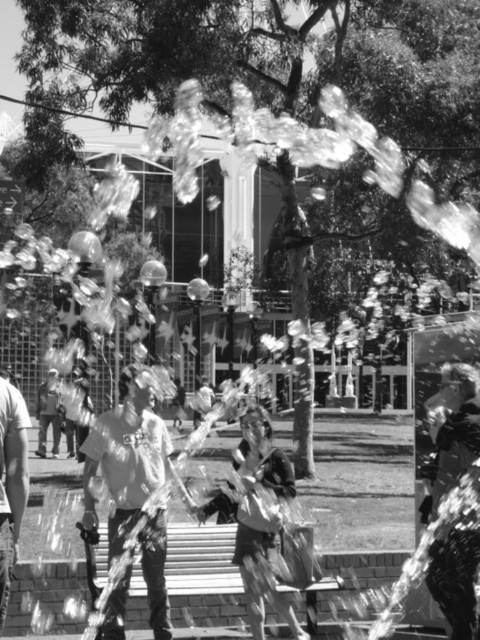
Which is more to the left, matte white shirt at center or matte white shirt at left?

Positioned to the left is matte white shirt at left.

Does point (155, 541) come farther from viewer compared to point (3, 529)?

Yes.

At what (x,y) coordinates should I click in order to perform the action: click on matte white shirt at center. Please return your answer as a coordinate pair (x, y). Image resolution: width=480 pixels, height=640 pixels. Looking at the image, I should click on (123, 460).